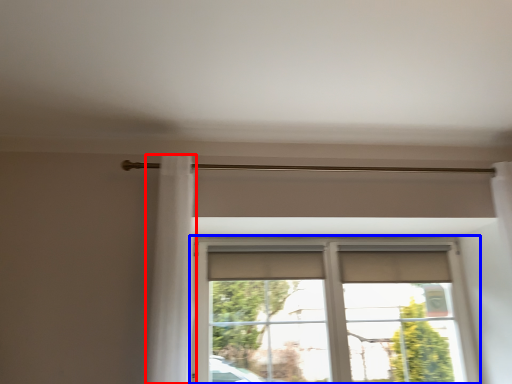
Question: Which object appears farthest to the camera in this image, shower curtain (highlighted by a red box) or window (highlighted by a blue box)?

Choices:
 (A) shower curtain
 (B) window

Answer: (B)